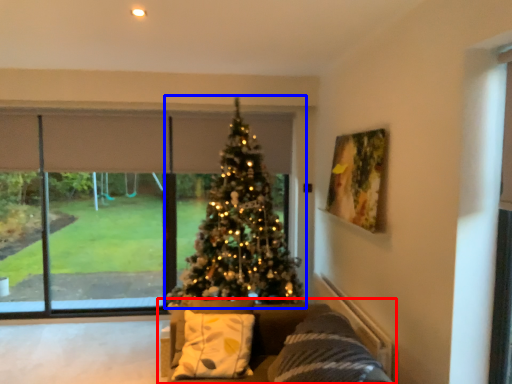
Question: Which object appears closest to the camera in this image, studio couch (highlighted by a red box) or christmas tree (highlighted by a blue box)?

Choices:
 (A) studio couch
 (B) christmas tree

Answer: (A)